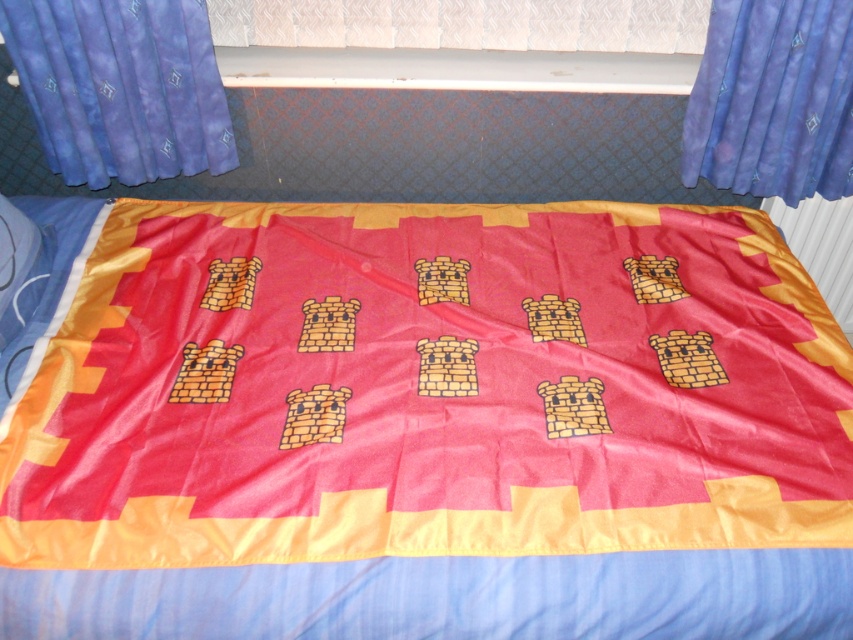
Question: Is satin red quilt at center smaller than blue satin curtain at upper right?

Choices:
 (A) yes
 (B) no

Answer: (B)

Question: Does satin red quilt at center appear under blue satin curtain at upper right?

Choices:
 (A) no
 (B) yes

Answer: (B)

Question: Does blue fabric curtain at upper left have a larger size compared to blue satin curtain at upper right?

Choices:
 (A) no
 (B) yes

Answer: (A)

Question: Which of the following is the farthest from the observer?

Choices:
 (A) (12, 42)
 (B) (788, 152)
 (C) (202, 401)

Answer: (B)

Question: Among these objects, which one is nearest to the camera?

Choices:
 (A) satin red quilt at center
 (B) blue satin curtain at upper right
 (C) blue fabric curtain at upper left

Answer: (A)

Question: Among these points, which one is farthest from the camera?

Choices:
 (A) (827, 83)
 (B) (595, 444)
 (C) (134, 132)

Answer: (C)